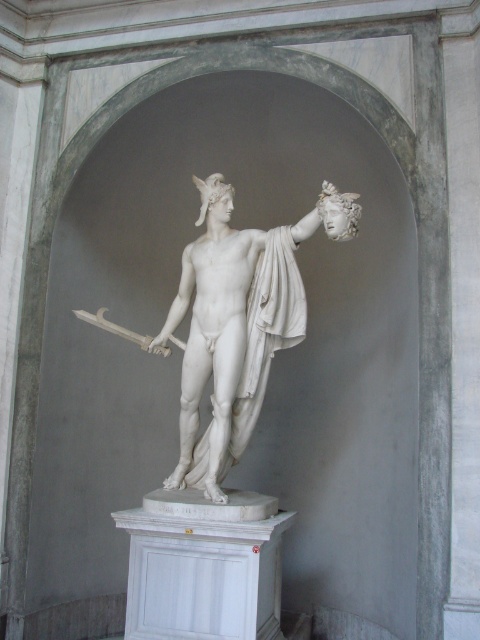
Between white marble statue at center and polished silver sword at center, which one appears on the left side from the viewer's perspective?

polished silver sword at center

Can you confirm if white marble statue at center is positioned below polished silver sword at center?

Yes.

Measure the distance between point (180,436) and camera.

Point (180,436) is 4.72 meters away from camera.

This screenshot has width=480, height=640. Identify the location of white marble statue at center. (239, 323).